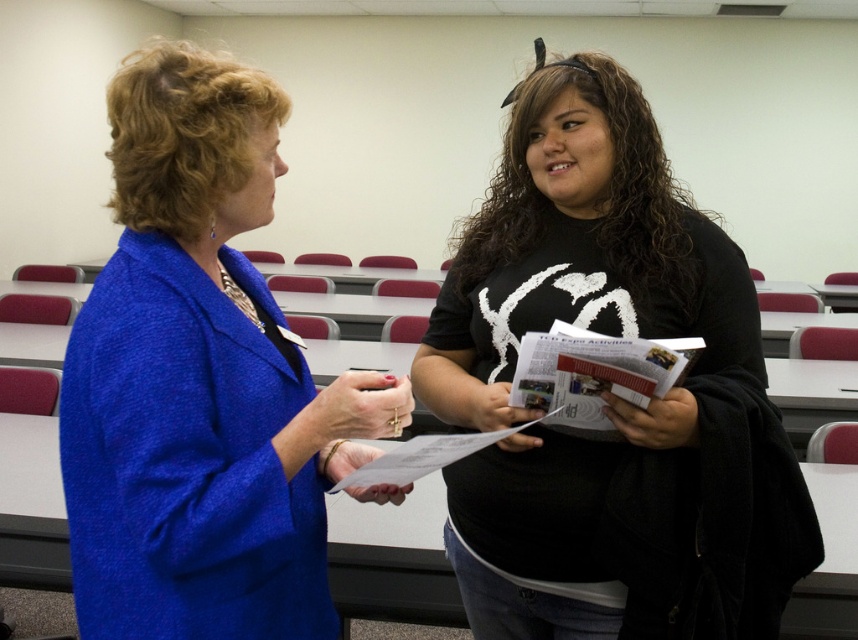
Which is more to the right, blue textured blazer at left or black matte shirt at center?

black matte shirt at center

Is the position of blue textured blazer at left more distant than that of black matte shirt at center?

No, blue textured blazer at left is closer to the viewer.

I want to click on blue textured blazer at left, so click(200, 380).